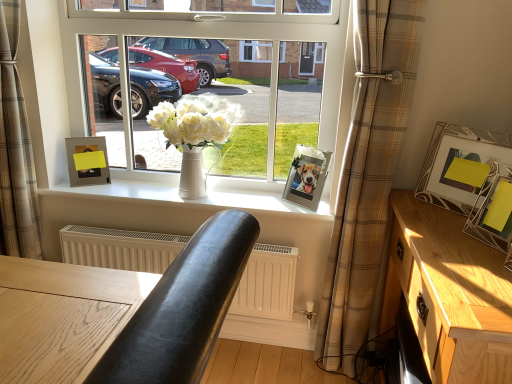
Question: Is white smooth vase at center wider or thinner than beige plaid curtain at lower left, which ranks as the 2th curtain in right-to-left order?

Choices:
 (A) thin
 (B) wide

Answer: (B)

Question: In terms of size, does white smooth vase at center appear bigger or smaller than beige plaid curtain at lower left, which ranks as the 2th curtain in right-to-left order?

Choices:
 (A) small
 (B) big

Answer: (A)

Question: Which object is positioned closest to the metallic silver picture frame at right, acting as the third picture frame starting from the left?

Choices:
 (A) white ceramic vase at center
 (B) plaid fabric curtain at center, which appears as the second curtain when viewed from the left
 (C) metallic silver photo frame at center, positioned as the third picture frame in right-to-left order
 (D) light wood/dark finish cabinet at right, which ranks as the second table in front-to-back order
 (E) beige plaid curtain at lower left, which ranks as the 2th curtain in right-to-left order

Answer: (D)

Question: Which is farther from the yellow paper picture frame at right, the first picture frame from the right?

Choices:
 (A) white ceramic vase at center
 (B) matte silver picture frame at upper left, the 1th picture frame viewed from the left
 (C) white matte vase at center
 (D) wooden table at center, placed as the second table when sorted from back to front
 (E) plaid fabric curtain at center, arranged as the 1th curtain when viewed from the right

Answer: (B)